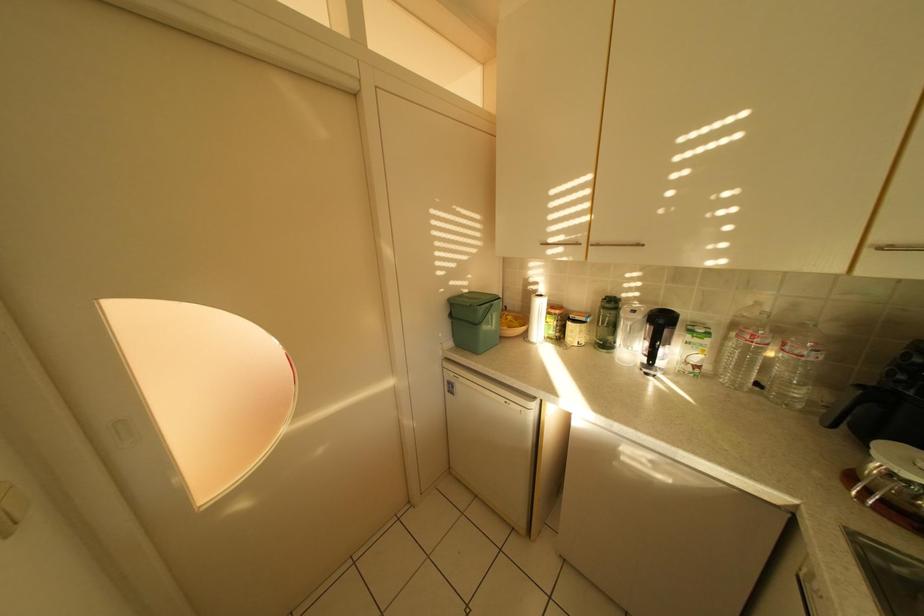
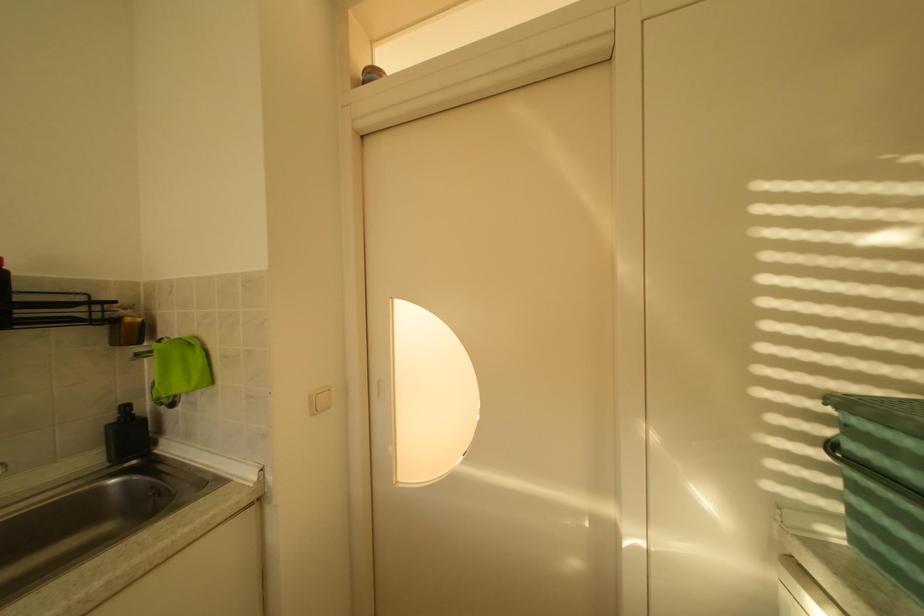
Question: The camera is either moving clockwise (left) or counter-clockwise (right) around the object. The first image is from the beginning of the video and the second image is from the end. Is the camera moving left or right when shooting the video?

Choices:
 (A) Left
 (B) Right

Answer: (B)